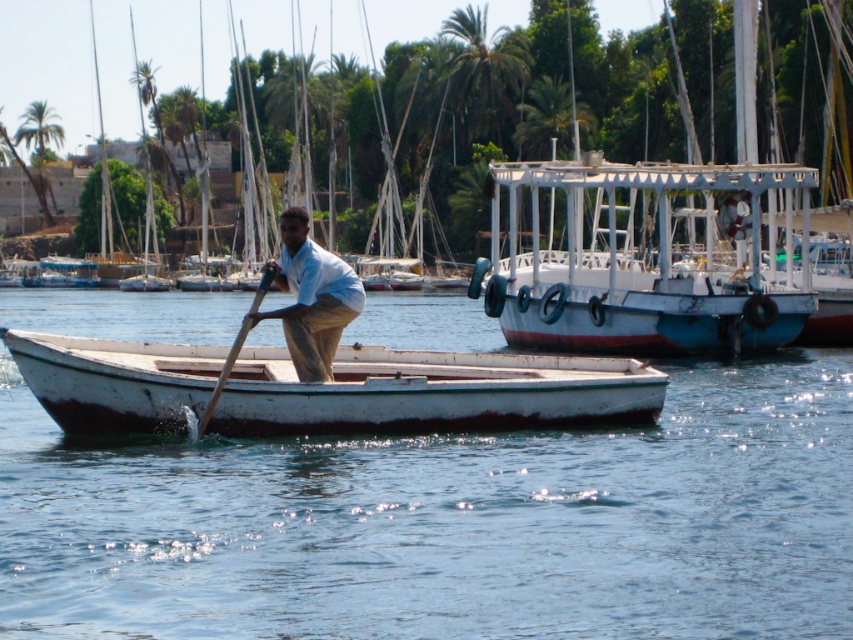
You are a photographer planning to take a wide shot of the scene. You need to ensure that the clear blue water at center and the wooden at left are both fully visible in the frame. Given that the camera can only capture a maximum width of 2 meters, will the total width of these two objects exceed the camera frame limit?

The clear blue water at center has a width larger than the wooden at left. However, since the camera can only capture up to 2 meters, and we don not have exact measurements, it is uncertain whether their combined width exceeds the limit. More information is needed.

You are standing on the shore of the river and see the white wooden boat at upper right and the green leafy palm tree at upper left. Which object is closer to the water surface?

The white wooden boat at upper right is closer to the water surface because it is located below the green leafy palm tree at upper left.

You are standing on the shore and see the white wooden boat at upper right and the green leafy palm tree at upper center. Which object is closer to you?

The white wooden boat at upper right is closer to you because it is in front of the green leafy palm tree at upper center.